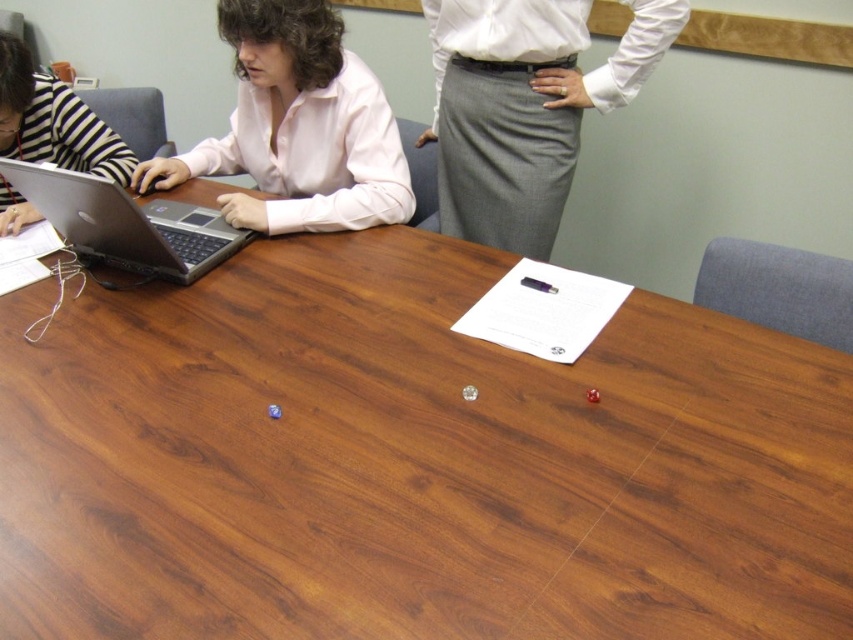
Question: Can you confirm if silver metallic laptop at left is positioned below striped fabric person at left?

Choices:
 (A) no
 (B) yes

Answer: (B)

Question: Which point is farther to the camera?

Choices:
 (A) (491, 164)
 (B) (109, 218)
 (C) (325, 548)
 (D) (306, 33)

Answer: (A)

Question: Does gray wool skirt at upper center lie in front of silver metallic laptop at left?

Choices:
 (A) no
 (B) yes

Answer: (A)

Question: Which of the following is the closest to the observer?

Choices:
 (A) (546, 38)
 (B) (4, 212)
 (C) (402, 620)

Answer: (C)

Question: Which of these objects is positioned closest to the matte pink shirt at upper left?

Choices:
 (A) gray wool skirt at upper center
 (B) silver metallic laptop at left
 (C) wooden table at center

Answer: (B)

Question: Does wooden table at center appear over matte pink shirt at upper left?

Choices:
 (A) yes
 (B) no

Answer: (B)